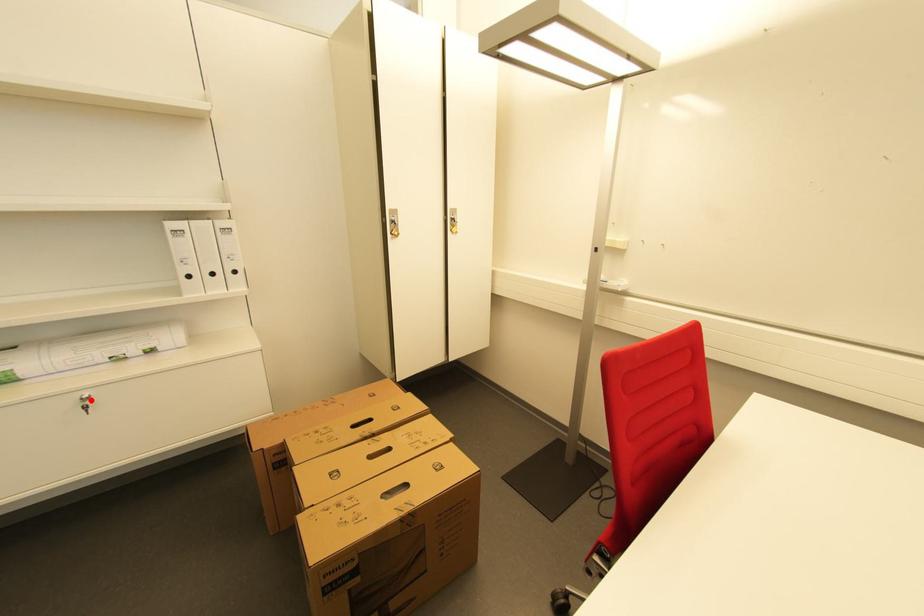
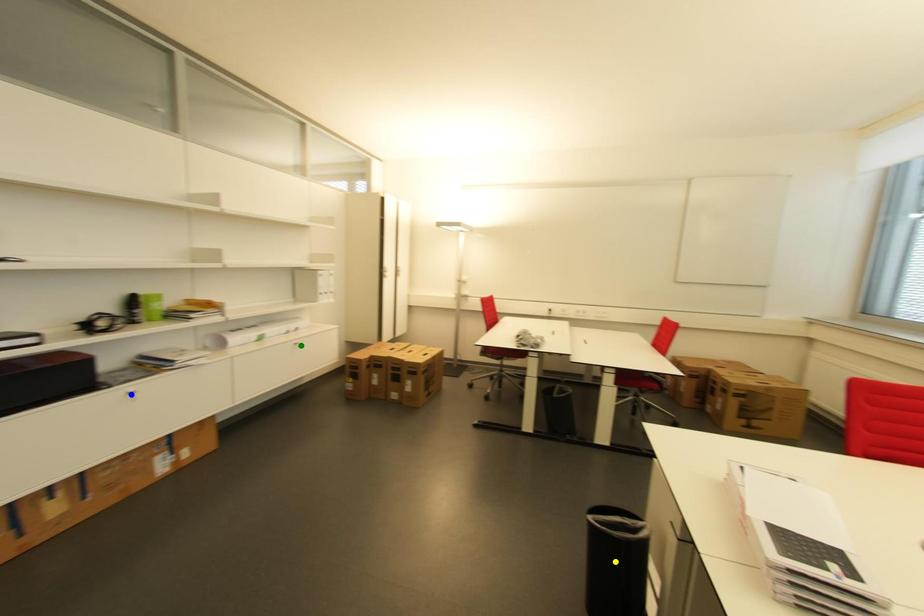
Question: I am providing you with two images of the same scene from different viewpoints. A red point is marked on the first image. You are given multiple points on the second image. In image 2, which mark is for the same physical point as the one in image 1?

Choices:
 (A) yellow point
 (B) green point
 (C) blue point

Answer: (B)